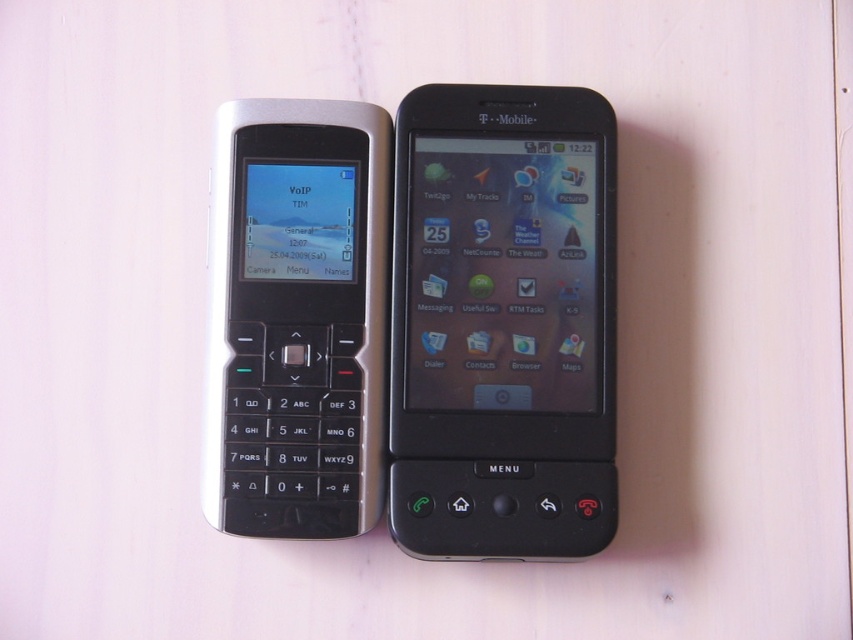
You are trying to place both the black plastic smartphone at center and the silver metallic keypad phone at left into a phone case designed for the smaller device. Will the larger device fit into the case?

The black plastic smartphone at center is larger than the silver metallic keypad phone at left, so it will not fit into the case designed for the smaller device.

Looking at this image, you are setting up a display for a tech history exhibit and want to place a label next to the black plastic smartphone at center. Given its position relative to the silver metallic keypad phone at left, where should you place the label so it doesn

The black plastic smartphone at center is located below the silver metallic keypad phone at left. Therefore, the label should be placed below the silver metallic keypad phone at left to be next to the black plastic smartphone at center.

You are setting up a display for a tech exhibition and need to place a small label next to the black plastic smartphone at center. According to the coordinates provided, where exactly should you position the label relative to the smartphone?

The black plastic smartphone at center is located at point (503, 323), so you should position the label near those coordinates to place it correctly next to the smartphone.